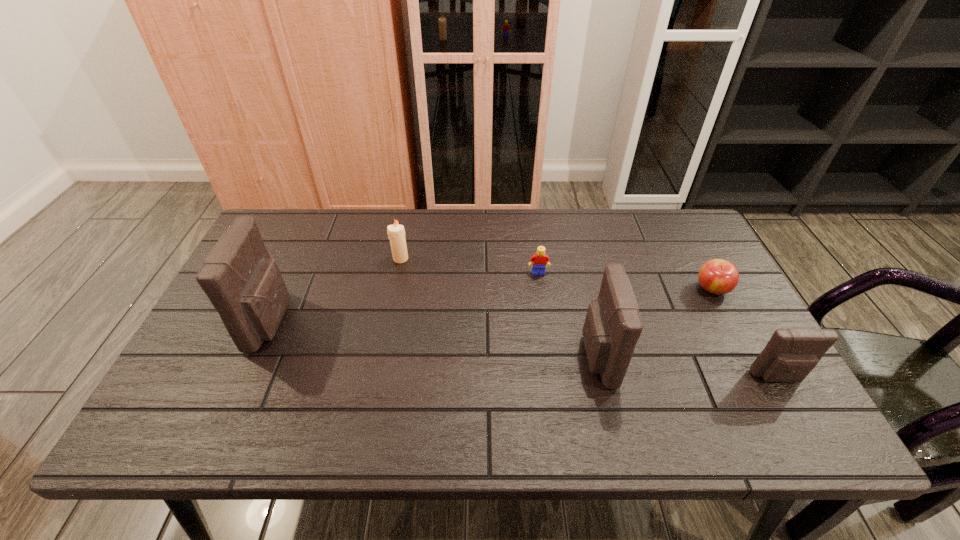
You are a GUI agent. You are given a task and a screenshot of the screen. Output one action in this format:
    pyautogui.click(x=<x>, y=<y>)
    Task: Click on the vacant space that satisfies the following two spatial constraints: 1. on the face of the fourth object from right to left; 2. with an open flap on the leftmost object
    
    Given the screenshot: What is the action you would take?
    pyautogui.click(x=545, y=321)

Find the location of a particular element. The height and width of the screenshot is (540, 960). blank area in the image that satisfies the following two spatial constraints: 1. on the face of the Lego; 2. on the left side of the apple is located at coordinates (540, 289).